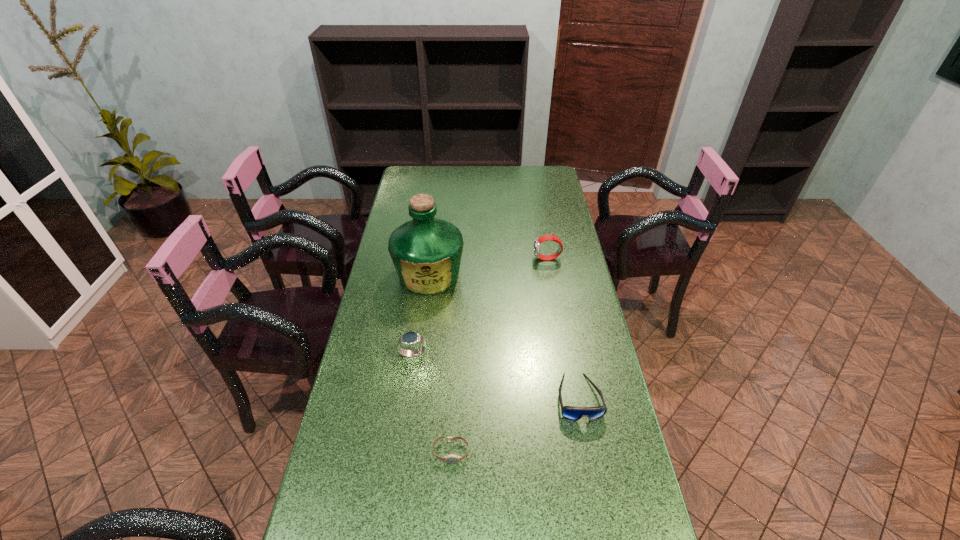
This screenshot has height=540, width=960. In order to click on liquor in this screenshot , I will do `click(426, 252)`.

Locate an element on the screen. the rightmost watch is located at coordinates (539, 240).

The image size is (960, 540). I want to click on the fourth shortest object, so click(539, 240).

At what (x,y) coordinates should I click in order to perform the action: click on the second nearest watch. Please return your answer as a coordinate pair (x, y). Looking at the image, I should click on (410, 338).

Locate an element on the screen. the leftmost watch is located at coordinates [410, 338].

Identify the location of the second shortest object. (573, 413).

Locate an element on the screen. The height and width of the screenshot is (540, 960). the second nearest object is located at coordinates (573, 413).

Locate an element on the screen. Image resolution: width=960 pixels, height=540 pixels. the nearest watch is located at coordinates (451, 458).

Where is `the shortest object`? Image resolution: width=960 pixels, height=540 pixels. the shortest object is located at coordinates (451, 458).

Locate an element on the screen. free spot located on the label side of the liquor is located at coordinates (424, 315).